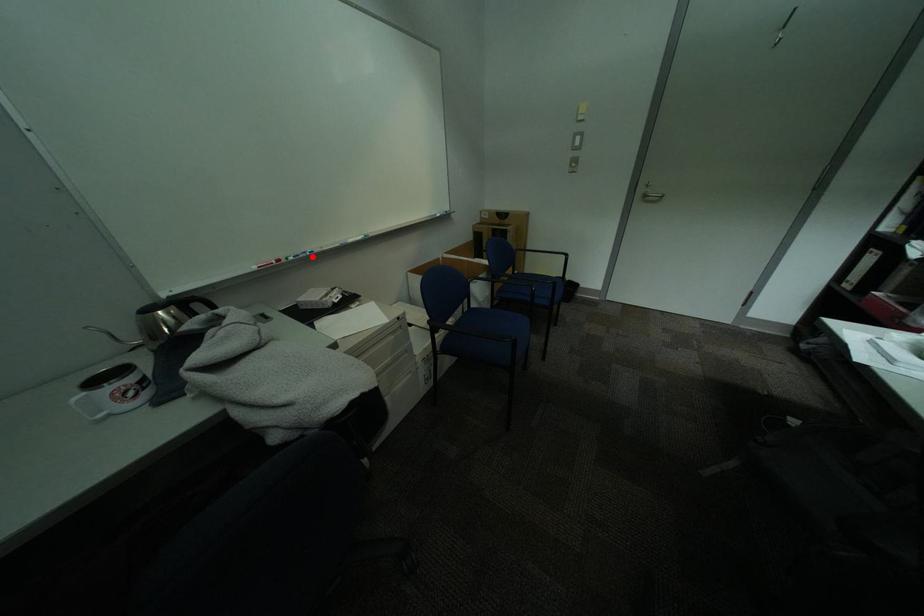
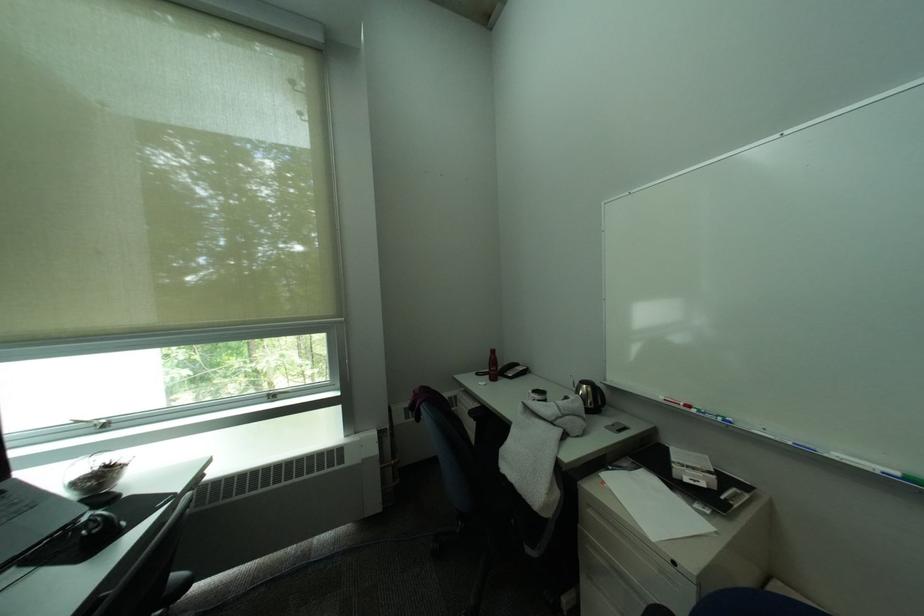
Find the pixel in the second image that matches the highlighted location in the first image.

(719, 416)